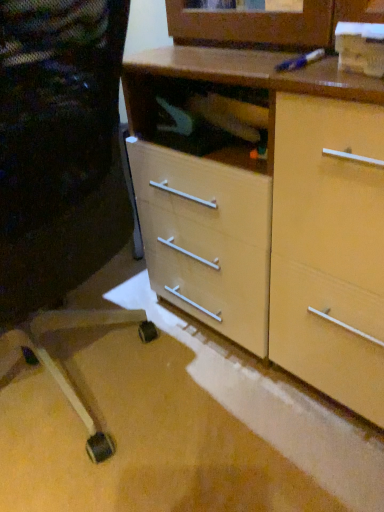
Question: Does matte wood chest of drawers at center have a lesser height compared to matte black chair at lower left?

Choices:
 (A) no
 (B) yes

Answer: (B)

Question: Is matte wood chest of drawers at center facing away from matte black chair at lower left?

Choices:
 (A) yes
 (B) no

Answer: (B)

Question: Would you say matte black chair at lower left is part of matte wood chest of drawers at center's contents?

Choices:
 (A) no
 (B) yes

Answer: (A)

Question: From a real-world perspective, is matte wood chest of drawers at center over matte black chair at lower left?

Choices:
 (A) yes
 (B) no

Answer: (A)

Question: Would you consider matte wood chest of drawers at center to be distant from matte black chair at lower left?

Choices:
 (A) yes
 (B) no

Answer: (B)

Question: Is matte wood chest of drawers at center taller than matte black chair at lower left?

Choices:
 (A) yes
 (B) no

Answer: (B)

Question: Considering the relative positions of matte black chair at lower left and matte wood chest of drawers at center in the image provided, is matte black chair at lower left to the right of matte wood chest of drawers at center from the viewer's perspective?

Choices:
 (A) yes
 (B) no

Answer: (B)

Question: From the image's perspective, is matte black chair at lower left on matte wood chest of drawers at center?

Choices:
 (A) yes
 (B) no

Answer: (B)

Question: From the image's perspective, is matte black chair at lower left below matte wood chest of drawers at center?

Choices:
 (A) no
 (B) yes

Answer: (B)

Question: Can you confirm if matte black chair at lower left is bigger than matte wood chest of drawers at center?

Choices:
 (A) yes
 (B) no

Answer: (A)

Question: From a real-world perspective, is matte black chair at lower left positioned over matte wood chest of drawers at center based on gravity?

Choices:
 (A) no
 (B) yes

Answer: (A)

Question: Considering the relative sizes of matte black chair at lower left and matte wood chest of drawers at center in the image provided, is matte black chair at lower left smaller than matte wood chest of drawers at center?

Choices:
 (A) no
 (B) yes

Answer: (A)

Question: From a real-world perspective, relative to matte black chair at lower left, is matte wood chest of drawers at center vertically above or below?

Choices:
 (A) above
 (B) below

Answer: (A)